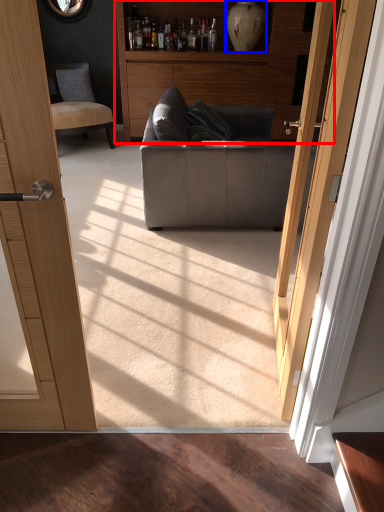
Question: Which object is further to the camera taking this photo, cabinetry (highlighted by a red box) or vase (highlighted by a blue box)?

Choices:
 (A) cabinetry
 (B) vase

Answer: (B)